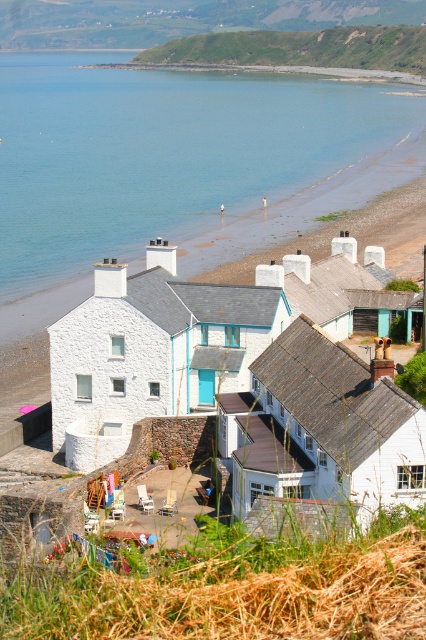
You are a photographer standing on the grassy area in front of the cottages. You want to take a photo that includes both the blue water at center and the white wood house at center. Which object should you position closer to the bottom of the frame to ensure both are fully visible?

The blue water at center is taller than the white wood house at center, so you should position the white wood house at center closer to the bottom of the frame to ensure both are fully visible.

You are standing at the beach and see two points marked in the image. One is at point (299, 109) and the other at point (98, 362). If you were to walk from the first point to the second, would you be moving towards the cottages or away from them?

Since point (299, 109) is behind point (98, 362), moving from the first to the second point would mean moving towards the cottages.

You are standing on the grassy area in front of the cottages and want to walk to the white stone house at center. Which direction should you move relative to the blue water at center?

You should move away from the blue water at center because the white stone house at center is behind the blue water at center from your current position.